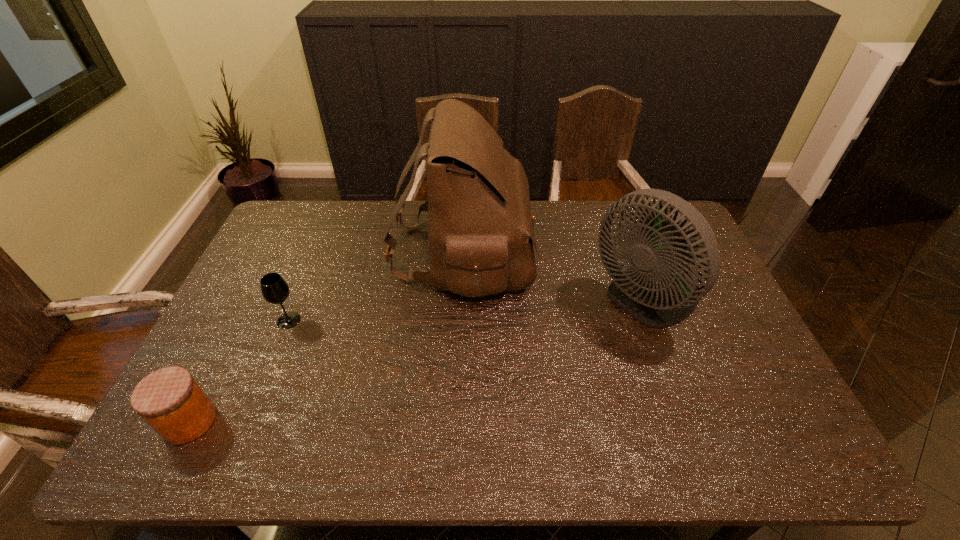
Locate an element on the screen. Image resolution: width=960 pixels, height=540 pixels. vacant region between the second object from left to right and the satchel is located at coordinates (376, 287).

Locate an element on the screen. This screenshot has width=960, height=540. free spot between the satchel and the fan is located at coordinates (555, 278).

Find the location of a particular element. Image resolution: width=960 pixels, height=540 pixels. vacant region between the leftmost object and the wineglass is located at coordinates [239, 371].

This screenshot has height=540, width=960. Find the location of `empty space between the wineglass and the satchel`. empty space between the wineglass and the satchel is located at coordinates (376, 287).

Where is `unoccupied area between the third object from right to left and the third shortest object`? The width and height of the screenshot is (960, 540). unoccupied area between the third object from right to left and the third shortest object is located at coordinates (468, 311).

What are the coordinates of `object that stands as the second closest to the satchel` in the screenshot? It's located at (274, 289).

Choose which object is the second nearest neighbor to the third object from right to left. Please provide its 2D coordinates. Your answer should be formatted as a tuple, i.e. [(x, y)], where the tuple contains the x and y coordinates of a point satisfying the conditions above.

[(480, 227)]

The width and height of the screenshot is (960, 540). I want to click on vacant region that satisfies the following two spatial constraints: 1. in front of the fan to direct airflow; 2. on the front side of the jar, so click(x=691, y=421).